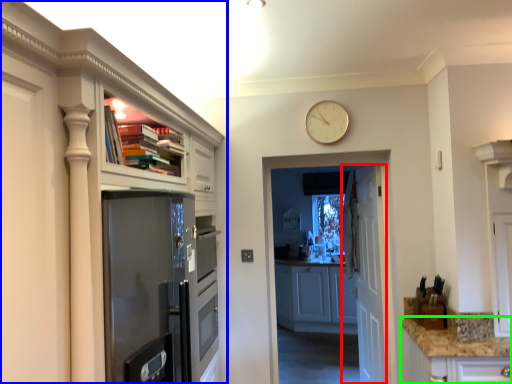
Question: Considering the real-world distances, which object is farthest from door (highlighted by a red box)? cabinetry (highlighted by a blue box) or counter top (highlighted by a green box)?

Choices:
 (A) cabinetry
 (B) counter top

Answer: (A)